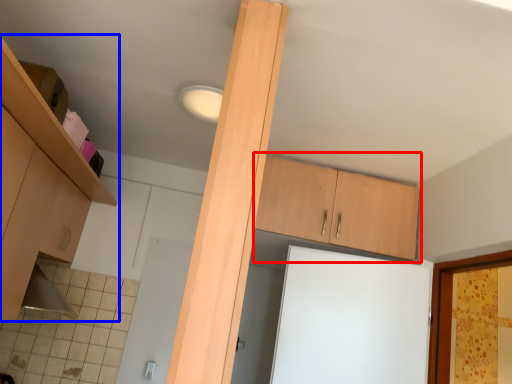
Question: Which point is further to the camera, cabinetry (highlighted by a red box) or cabinetry (highlighted by a blue box)?

Choices:
 (A) cabinetry
 (B) cabinetry

Answer: (A)